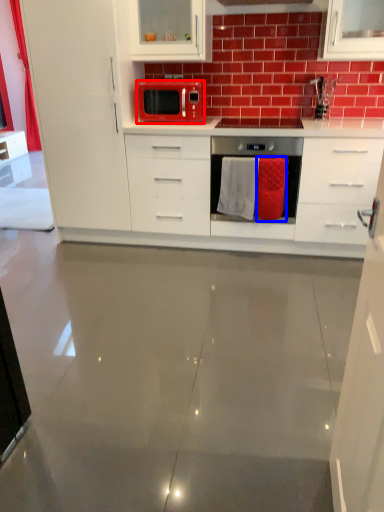
Question: Which point is closer to the camera, kitchen appliance (highlighted by a red box) or cloth (highlighted by a blue box)?

Choices:
 (A) kitchen appliance
 (B) cloth

Answer: (B)